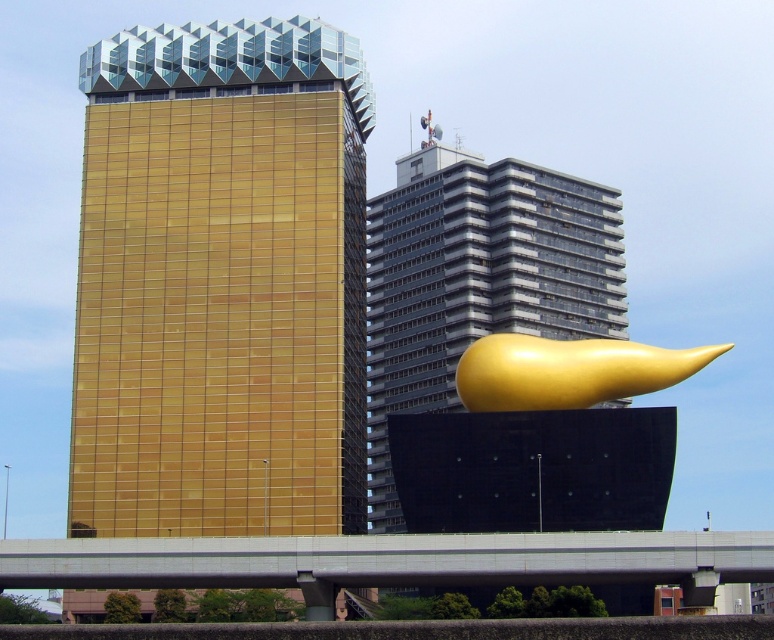
You are an architect visiting the city and want to take a photo of both the gold glass tower at center and the gold polished sculpture at center. Which object should you position to the left in your camera frame to capture both in the shot?

To capture both the gold glass tower at center and the gold polished sculpture at center in your photo, position the gold glass tower at center to the left side of the gold polished sculpture at center in your camera frame, as it is already positioned on the left side of the sculpture in the scene.

You are standing in the urban landscape and want to take a photo of both the gold glass tower at center and the shiny metallic sculpture at center. Which object should you focus on first to ensure both are in the frame?

You should focus on the gold glass tower at center first since it is closer to the viewer than the shiny metallic sculpture at center, ensuring both remain in the frame when adjusting the camera.